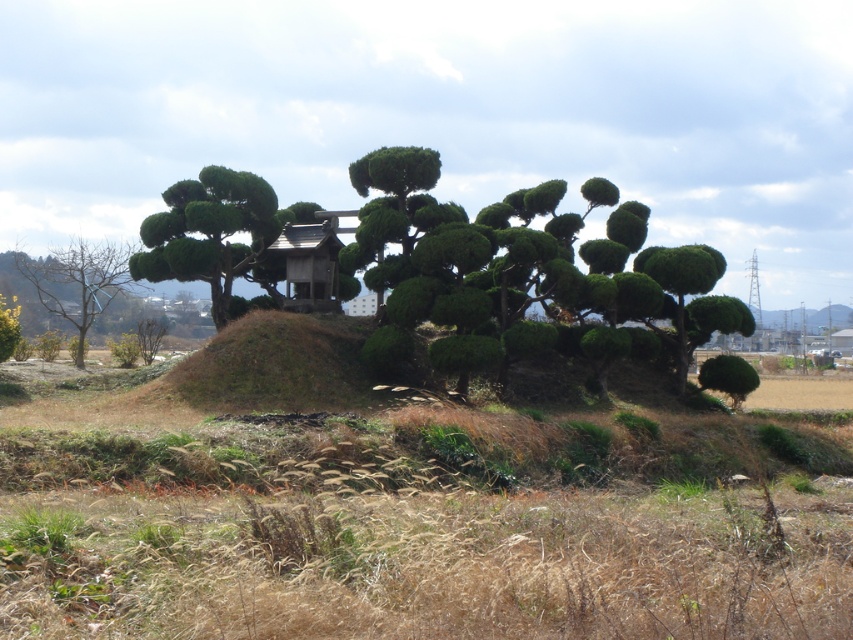
Can you confirm if green leafy bush at center is wider than green leafy bush at right?

Indeed, green leafy bush at center has a greater width compared to green leafy bush at right.

Which is more to the left, green leafy bush at center or green leafy bush at right?

green leafy bush at center is more to the left.

Which is in front, point (691, 244) or point (740, 364)?

Point (740, 364) is in front.

The height and width of the screenshot is (640, 853). Find the location of `green leafy bush at center`. green leafy bush at center is located at coordinates (491, 266).

Looking at this image, who is positioned more to the left, green leafy bush at center or wooden hut at center?

wooden hut at center is more to the left.

You are a GUI agent. You are given a task and a screenshot of the screen. Output one action in this format:
    pyautogui.click(x=<x>, y=<y>)
    Task: Click on the green leafy bush at center
    The height and width of the screenshot is (640, 853).
    Given the screenshot: What is the action you would take?
    pyautogui.click(x=491, y=266)

Which of these two, wooden hut at center or green leafy bush at right, stands shorter?

With less height is wooden hut at center.

Does wooden hut at center appear over green leafy bush at right?

Yes.

Which is in front, point (264, 275) or point (734, 356)?

Point (734, 356) is more forward.

Identify the location of wooden hut at center. The height and width of the screenshot is (640, 853). (305, 268).